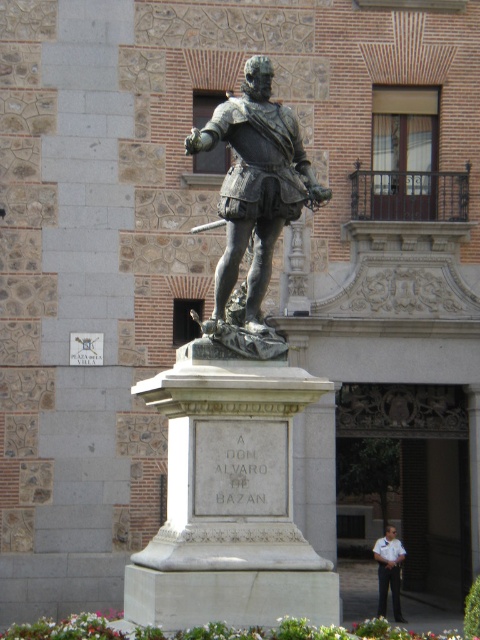
Question: Which is farther from the bronze statue at center?

Choices:
 (A) bronze armor at center
 (B) white uniform at center

Answer: (B)

Question: Based on their relative distances, which object is nearer to the bronze armor at center?

Choices:
 (A) white uniform at center
 (B) bronze statue at center

Answer: (B)

Question: Does bronze armor at center appear under white uniform at center?

Choices:
 (A) yes
 (B) no

Answer: (B)

Question: Which of these objects is positioned closest to the bronze statue at center?

Choices:
 (A) bronze armor at center
 (B) white uniform at center

Answer: (A)

Question: Where is bronze statue at center located in relation to bronze armor at center in the image?

Choices:
 (A) left
 (B) right

Answer: (A)

Question: Does bronze armor at center lie in front of white uniform at center?

Choices:
 (A) no
 (B) yes

Answer: (B)